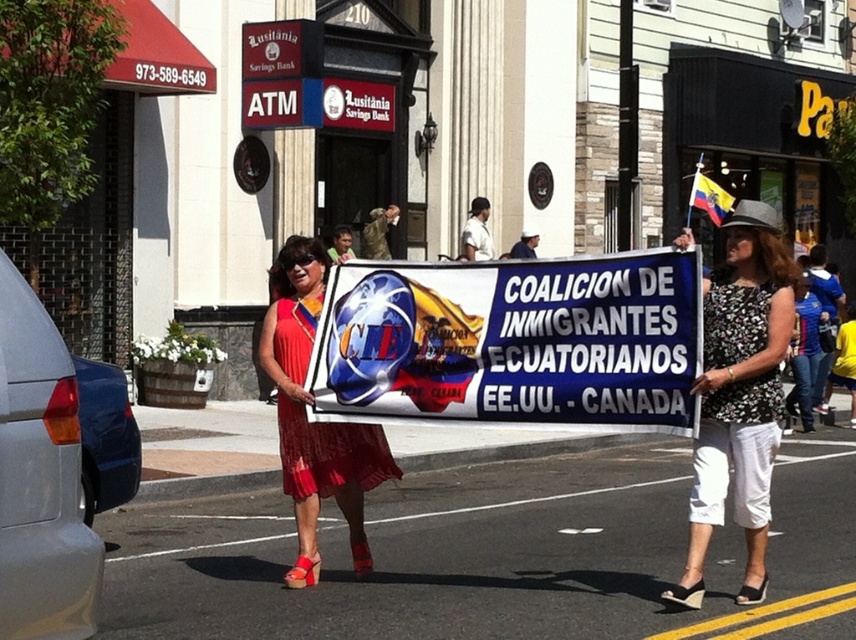
You are a photographer at the event and want to capture both the white fabric banner at center and the white cotton shirt at upper center in the same frame. Since the banner is larger, will it block the view of the shirt?

The white fabric banner at center is larger than the white cotton shirt at upper center. Since the banner is positioned at the center and the shirt is at upper center, the banner might block part of the shirt depending on their exact positions. However, since the shirt is at upper center, it might still be visible above the banner.